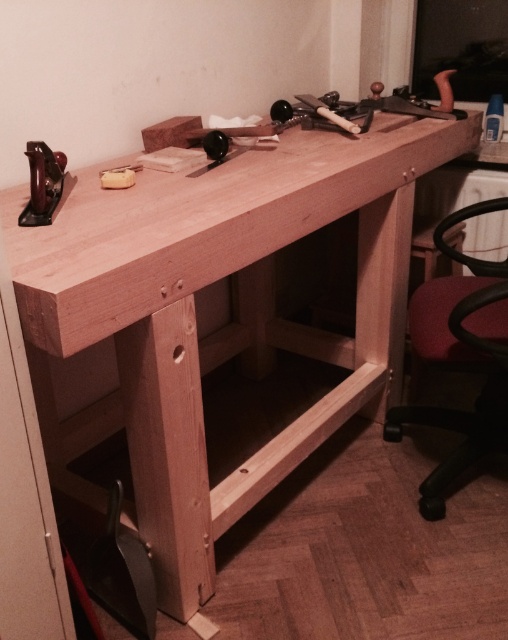
You are a carpenter standing in front of the workbench. You need to place a 40 inch long piece of wood on the natural wood counter top at center. Can you fit it on the counter?

The distance between the natural wood counter top at center and the camera is 37.54 inches. Since the piece of wood is 40 inches long, it cannot be placed on the counter as it exceeds the available space.

You are a carpenter who needs to place a new tool on the workbench. The natural wood counter top at center and the matte black plane at left are both options. Which surface is bigger and can accommodate a larger tool?

The natural wood counter top at center has a larger size compared to the matte black plane at left, so it can accommodate a larger tool.